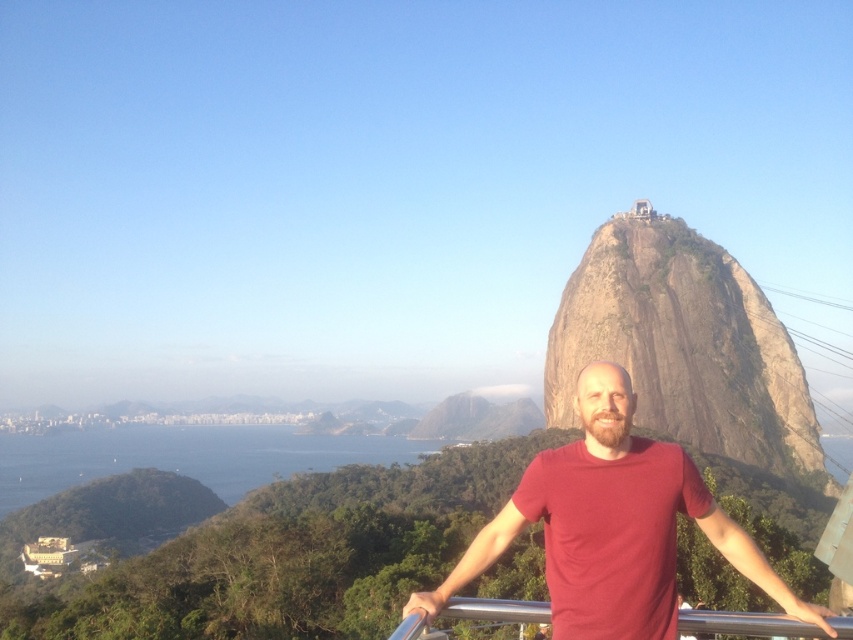
You are a tourist standing at the scenic viewpoint. You see the rocky brown at center and the silver metallic rail at center. Which object is closer to you?

The silver metallic rail at center is behind the rocky brown at center, so the rocky brown at center is closer to you.